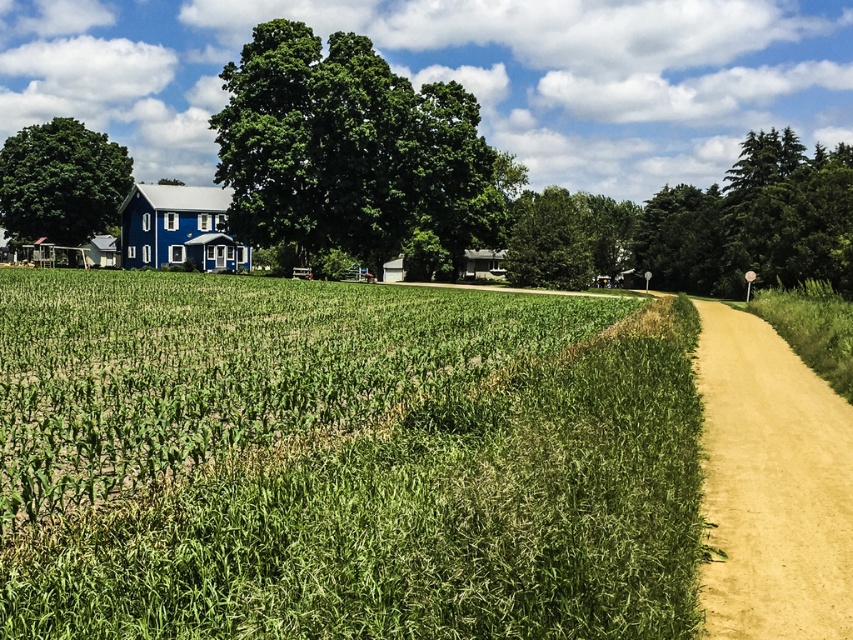
Is point (766, 168) positioned in front of point (56, 186)?

That is True.

This screenshot has width=853, height=640. Find the location of `green leafy tree at upper right`. green leafy tree at upper right is located at coordinates (705, 225).

Find the location of a particular element. green leafy tree at upper right is located at coordinates (705, 225).

Is green grassy corn field at center positioned behind dirt road at right?

That is False.

Who is positioned more to the right, green grassy corn field at center or dirt road at right?

From the viewer's perspective, dirt road at right appears more on the right side.

Which is behind, point (485, 634) or point (750, 464)?

The point (750, 464) is behind.

In order to click on green grassy corn field at center in this screenshot , I will do click(340, 460).

Between point (817, 600) and point (583, 243), which one is positioned in front?

Point (817, 600) is more forward.

Can you confirm if dirt road at right is positioned to the left of green leafy tree at center?

Indeed, dirt road at right is positioned on the left side of green leafy tree at center.

Is point (755, 588) farther from camera compared to point (561, 218)?

No.

Identify the location of dirt road at right. click(x=770, y=484).